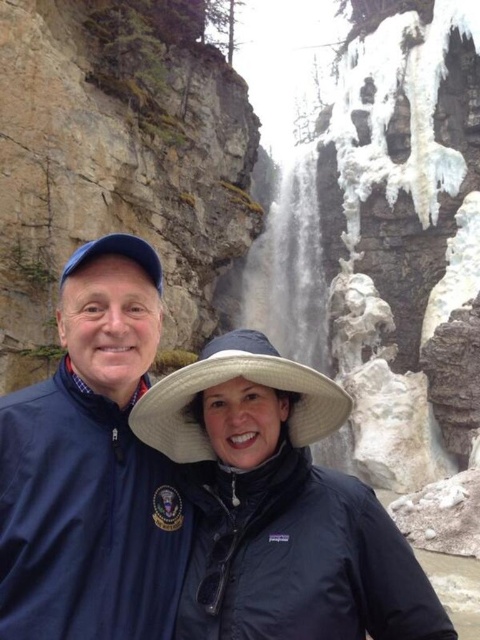
You are a photographer trying to capture both the black matte jacket at center and the blue fabric jacket at left in the same frame. Based on their positions, which jacket will appear smaller in the photo?

The blue fabric jacket at left will appear smaller in the photo because it is positioned behind the black matte jacket at center, making it farther from the camera and thus appear smaller.

You are a photographer trying to capture both the black matte jacket at center and the blue fabric jacket at left in a single frame. Given that your camera can only focus on objects within a 1.5 meter width, will both jackets fit in the frame if they are positioned side by side?

The black matte jacket at center is bigger than the blue fabric jacket at left. Since the camera can focus on objects within a 1.5 meter width, the total width of both jackets combined must be less than or equal to 1.5 meters. However, without knowing the exact dimensions of each jacket, it is impossible to determine if they will fit within the frame.

You are a photographer trying to capture a photo of the black matte jacket at center and the blue fabric jacket at left. If you want to ensure both jackets are fully visible in the frame, which jacket should you focus on first to avoid cropping?

The black matte jacket at center has a lesser height compared to the blue fabric jacket at left. Therefore, you should focus on the blue fabric jacket at left first to ensure it fits entirely in the frame before adjusting for the shorter black matte jacket at center.